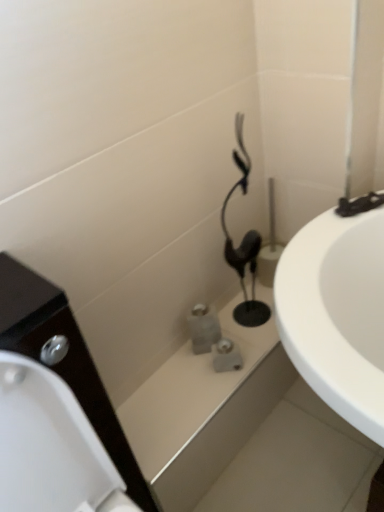
Question: From a real-world perspective, is matte gray stone bath at center, the 2th bath from the front, below black plastic hairdryer at center?

Choices:
 (A) no
 (B) yes

Answer: (B)

Question: Does matte gray stone bath at center, the first bath from the back, appear on the right side of black plastic hairdryer at center?

Choices:
 (A) no
 (B) yes

Answer: (A)

Question: Considering the relative sizes of matte gray stone bath at center, the 2th bath from the front, and black plastic hairdryer at center in the image provided, is matte gray stone bath at center, the 2th bath from the front, thinner than black plastic hairdryer at center?

Choices:
 (A) no
 (B) yes

Answer: (A)

Question: Is matte gray stone bath at center, the 2th bath from the front, oriented towards black plastic hairdryer at center?

Choices:
 (A) no
 (B) yes

Answer: (A)

Question: From the image's perspective, is matte gray stone bath at center, the 2th bath from the front, beneath black plastic hairdryer at center?

Choices:
 (A) yes
 (B) no

Answer: (A)

Question: Is matte gray stone bath at center, the 2th bath from the front, outside of black plastic hairdryer at center?

Choices:
 (A) no
 (B) yes

Answer: (B)

Question: Is black plastic hairdryer at center to the left of white glossy bath at center, which is counted as the 1th bath, starting from the front, from the viewer's perspective?

Choices:
 (A) yes
 (B) no

Answer: (B)

Question: Can you confirm if black plastic hairdryer at center is thinner than white glossy bath at center, which is counted as the 1th bath, starting from the front?

Choices:
 (A) yes
 (B) no

Answer: (A)

Question: Can you confirm if black plastic hairdryer at center is positioned to the right of white glossy bath at center, which is counted as the 1th bath, starting from the front?

Choices:
 (A) yes
 (B) no

Answer: (A)

Question: Is black plastic hairdryer at center directly adjacent to white glossy bath at center, acting as the 2th bath starting from the back?

Choices:
 (A) no
 (B) yes

Answer: (A)

Question: Considering the relative sizes of black plastic hairdryer at center and white glossy bath at center, which is counted as the 1th bath, starting from the front, in the image provided, is black plastic hairdryer at center smaller than white glossy bath at center, which is counted as the 1th bath, starting from the front,?

Choices:
 (A) no
 (B) yes

Answer: (B)

Question: Is black plastic hairdryer at center positioned beyond the bounds of white glossy bath at center, acting as the 2th bath starting from the back?

Choices:
 (A) yes
 (B) no

Answer: (A)

Question: Is the surface of white glossy bath at center, acting as the 2th bath starting from the back, in direct contact with black plastic hairdryer at center?

Choices:
 (A) yes
 (B) no

Answer: (B)